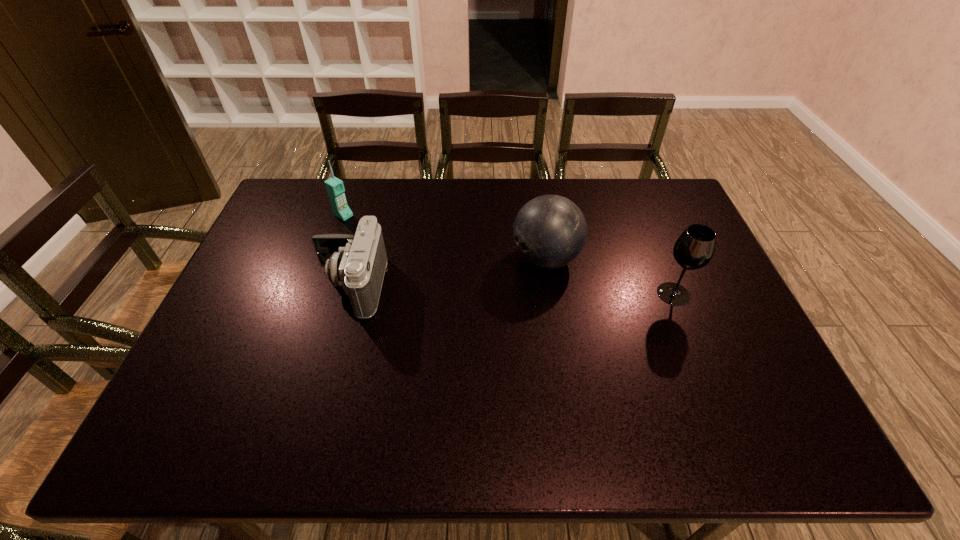
I want to click on vacant space on the desktop that is between the shortest object and the rightmost object and is positioned on the grip area of the bowling ball, so click(x=476, y=289).

This screenshot has width=960, height=540. I want to click on vacant space on the desktop that is between the shortest object and the rightmost object and is positioned on the keypad of the cellular telephone, so (x=464, y=288).